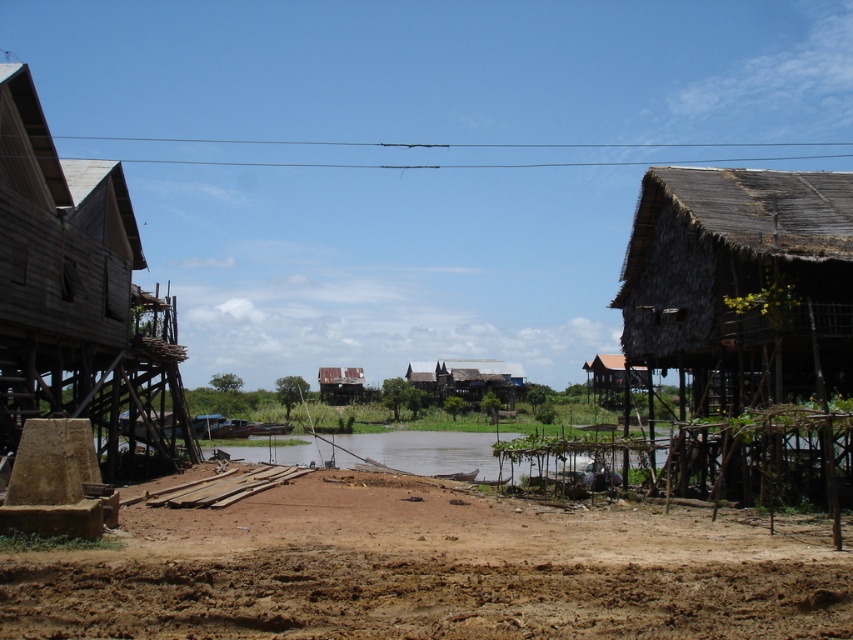
You are a traveler standing on the dirt path in the rural riverside scene. You see the wooden hut at left and the rusty corrugated metal hut at center. Which of these two huts is positioned higher in elevation?

The wooden hut at left is positioned higher in elevation than the rusty corrugated metal hut at center because it is above it.